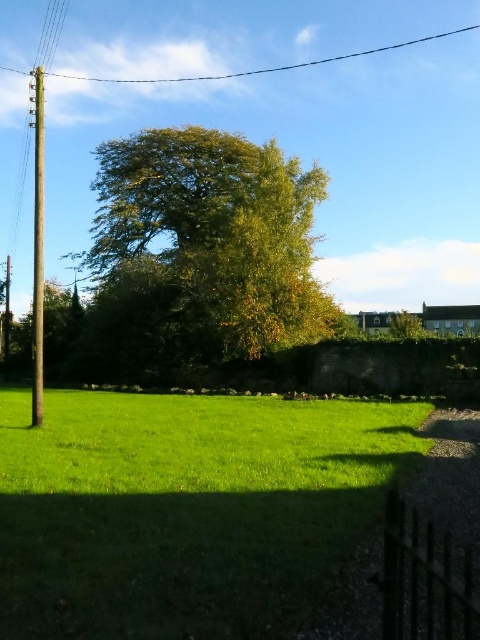
You are standing in the rural scene and want to place a small garden ornament exactly halfway between the two points, point (x=204, y=196) and point (x=240, y=74). Given that the scene has a coordinate system where the bottom left corner is the origin, will the ornament be closer to the wooden utility pole on the left or the cluster of trees in the midground?

The ornament will be closer to the wooden utility pole on the left because the halfway point between point (x=204, y=196) and point (x=240, y=74) is closer to the pole, which is located on the left side of the scene.

You are standing at the center of the image. Which direction should you walk to reach the green grass at lower left?

You should walk towards the lower left direction to reach the green grass at lower left.